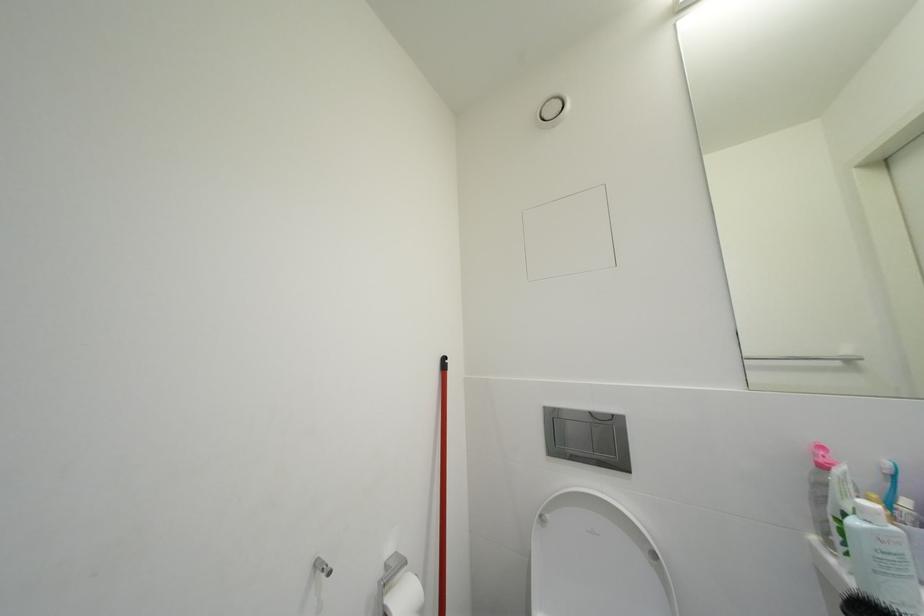
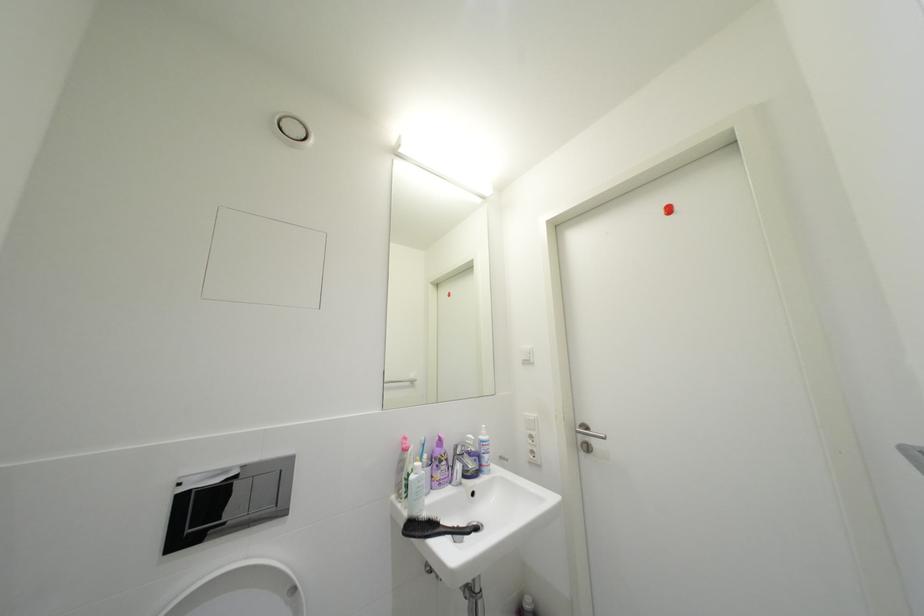
Question: The camera is either moving clockwise (left) or counter-clockwise (right) around the object. The first image is from the beginning of the video and the second image is from the end. Is the camera moving left or right when shooting the video?

Choices:
 (A) Left
 (B) Right

Answer: (A)